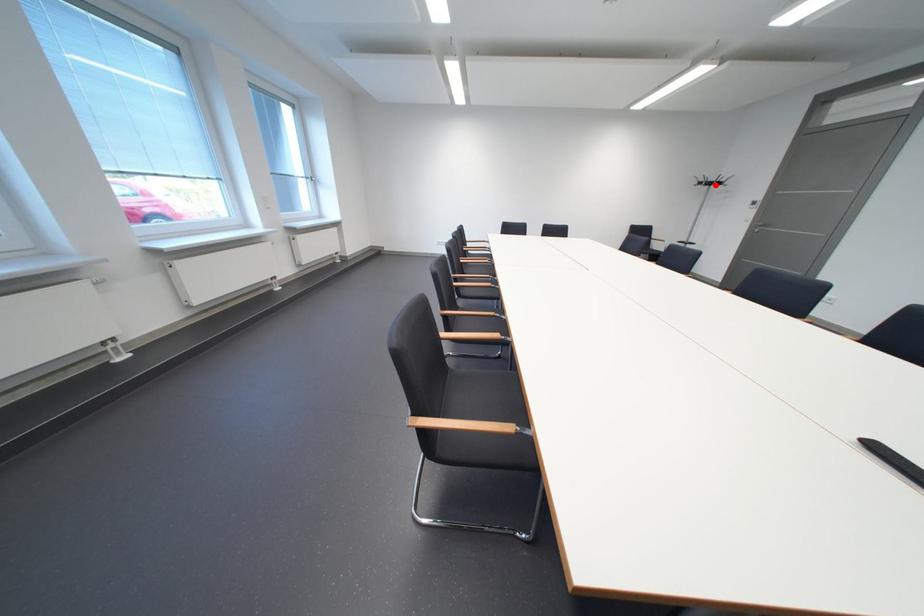
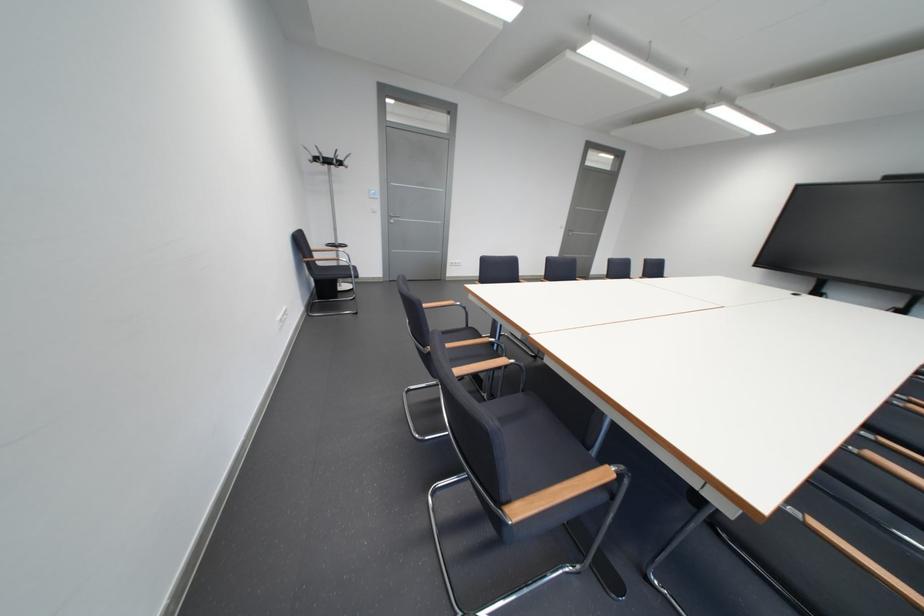
Question: I am providing you with two images of the same scene from different viewpoints. In image1, a red point is highlighted. Considering the same 3D point in image2, which of the following is correct?

Choices:
 (A) It is closer
 (B) It is farther

Answer: (A)